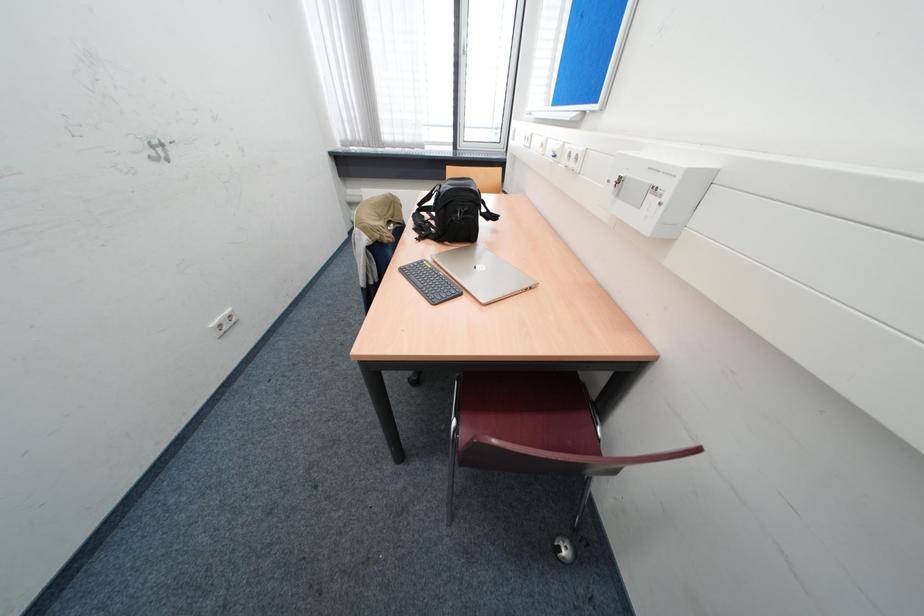
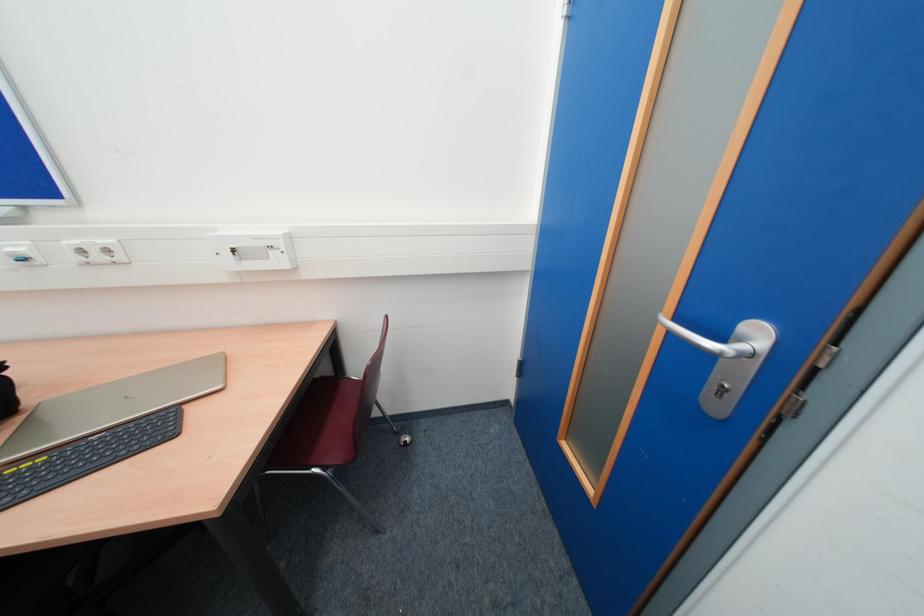
The first image is from the beginning of the video and the second image is from the end. How did the camera likely rotate when shooting the video?

The rotation direction of the camera is right-down.